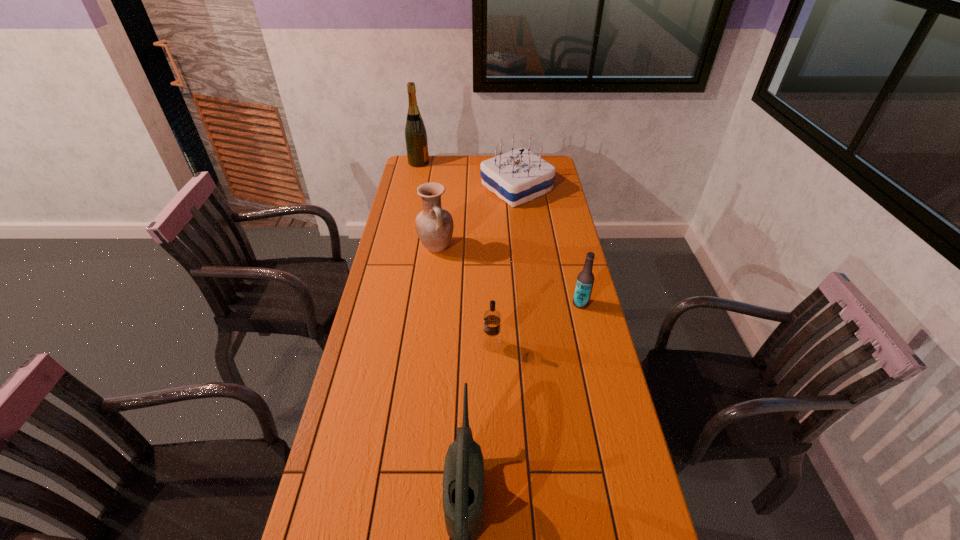
The width and height of the screenshot is (960, 540). Identify the location of vacant space in between the second farthest object and the third nearest object. (548, 246).

Locate an element on the screen. free spot between the birthday cake and the pottery is located at coordinates (476, 218).

Choose which object is the nearest neighbor to the fourth nearest object. Please provide its 2D coordinates. Your answer should be formatted as a tuple, i.e. [(x, y)], where the tuple contains the x and y coordinates of a point satisfying the conditions above.

[(518, 176)]

Identify which object is the third closest to the pottery. Please provide its 2D coordinates. Your answer should be formatted as a tuple, i.e. [(x, y)], where the tuple contains the x and y coordinates of a point satisfying the conditions above.

[(585, 279)]

Locate an element on the screen. vacant area in the image that satisfies the following two spatial constraints: 1. on the front-facing side of the tallest object; 2. on the back side of the second farthest object is located at coordinates (413, 188).

Where is `vacant space that satisfies the following two spatial constraints: 1. on the back side of the second object from left to right; 2. on the front-facing side of the farthest object`? This screenshot has width=960, height=540. vacant space that satisfies the following two spatial constraints: 1. on the back side of the second object from left to right; 2. on the front-facing side of the farthest object is located at coordinates [x=446, y=163].

Identify the location of free space that satisfies the following two spatial constraints: 1. on the front-facing side of the wine bottle; 2. on the right side of the second object from left to right. (400, 247).